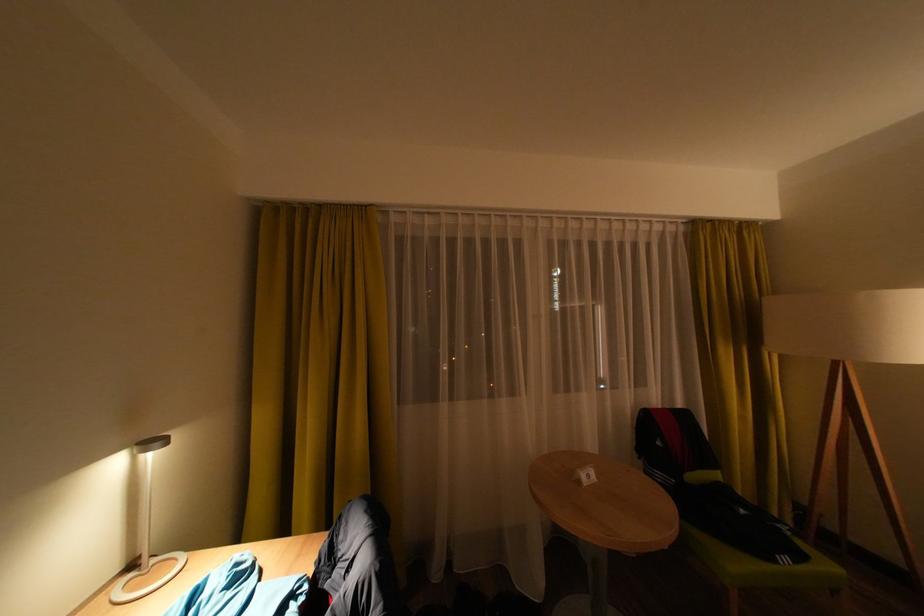
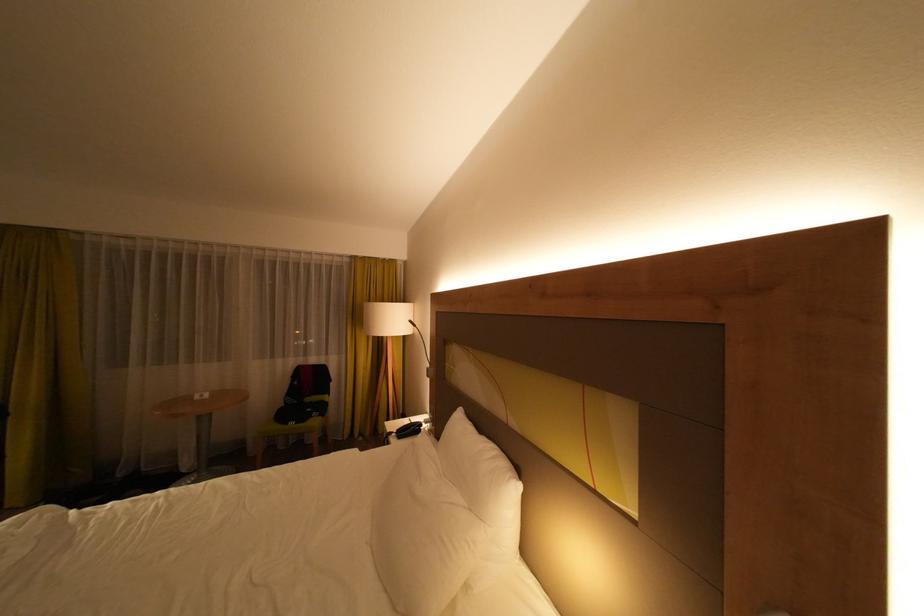
In a continuous first-person perspective shot, in which direction is the camera moving?

The cameraman moved toward right, backward.